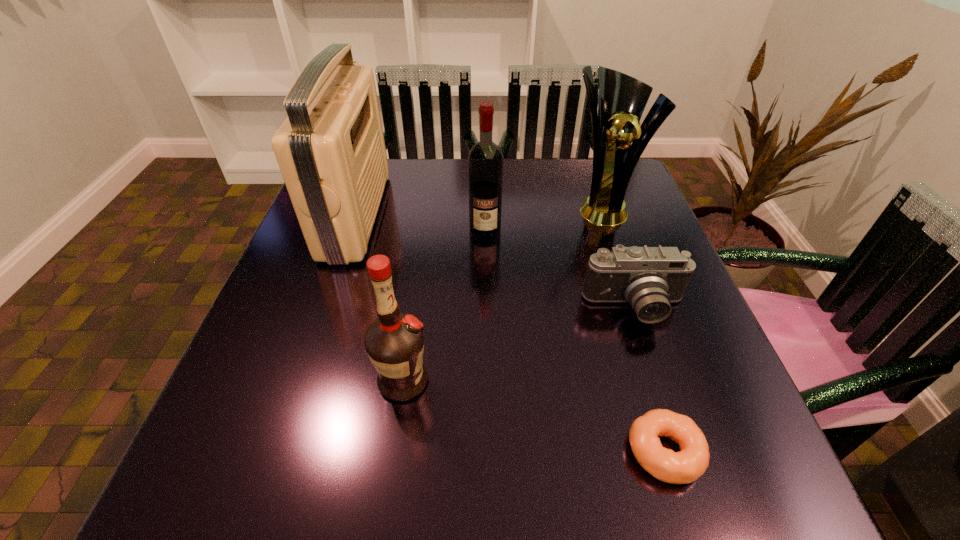
Where is `object that can be found as the fourth closest to the doughnut`? object that can be found as the fourth closest to the doughnut is located at coordinates (622, 99).

Identify the location of free space that satisfies the following two spatial constraints: 1. at the front of the award, where the globe is visible; 2. on the front and back of the second nearest object. (660, 381).

Image resolution: width=960 pixels, height=540 pixels. I want to click on vacant space that satisfies the following two spatial constraints: 1. on the front and back of the doughnut; 2. on the right side of the fourth object from right to left, so 488,451.